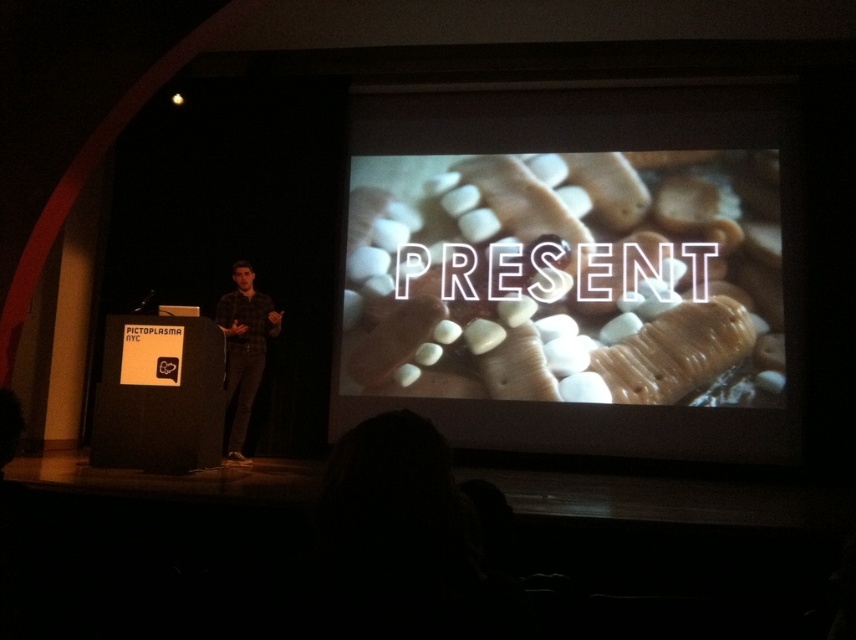
In the scene shown: You are organizing a snack table for an event and need to arrange items based on their sizes. You have the white matte marshmallows at center and the plaid shirt at center. Which item should you place first if you want to start with the larger item?

The white matte marshmallows at center is bigger than the plaid shirt at center, so you should place the white matte marshmallows at center first.

You are a stagehand who needs to place a 2 meter long ladder between the white matte marshmallows at center and the plaid shirt at center. Can the ladder fit between them without overlapping either object?

The distance between the white matte marshmallows at center and the plaid shirt at center is 2.12 meters. Since the ladder is 2 meters long, it can fit between them without overlapping either object as there is enough space.

You are an attendee at the presentation. You notice the white matte marshmallows at center and the plaid shirt at center. Which object is closer to you?

The white matte marshmallows at center are closer to you because they are further to the viewer than the plaid shirt at center.